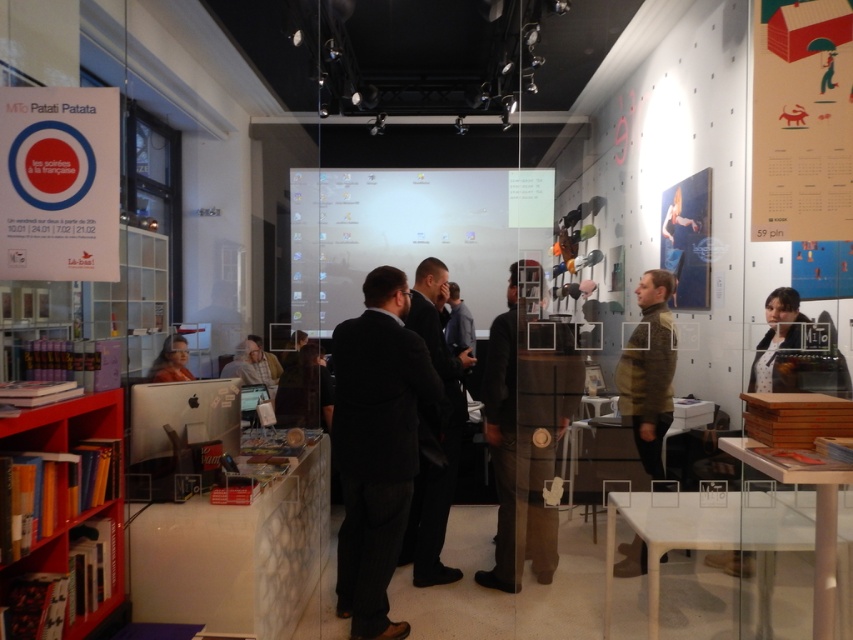
Is point (799, 61) closer to viewer compared to point (634, 432)?

Yes, point (799, 61) is in front of point (634, 432).

Who is more distant from viewer, (838, 120) or (662, 320)?

Point (662, 320)

Locate an element on the screen. Image resolution: width=853 pixels, height=640 pixels. matte paper calendar at upper right is located at coordinates (801, 120).

Who is more distant from viewer, (666, 298) or (184, 372)?

Positioned behind is point (184, 372).

Does camouflage jacket at center have a larger size compared to matte black monitor at lower left?

Indeed, camouflage jacket at center has a larger size compared to matte black monitor at lower left.

In order to click on camouflage jacket at center in this screenshot , I will do `click(648, 371)`.

Who is taller, dark brown leather jacket at center or matte black monitor at lower left?

dark brown leather jacket at center

Is dark brown leather jacket at center to the right of matte black monitor at lower left from the viewer's perspective?

Indeed, dark brown leather jacket at center is positioned on the right side of matte black monitor at lower left.

The width and height of the screenshot is (853, 640). What do you see at coordinates (502, 372) in the screenshot?
I see `dark brown leather jacket at center` at bounding box center [502, 372].

Where is `dark brown leather jacket at center`? The height and width of the screenshot is (640, 853). dark brown leather jacket at center is located at coordinates (502, 372).